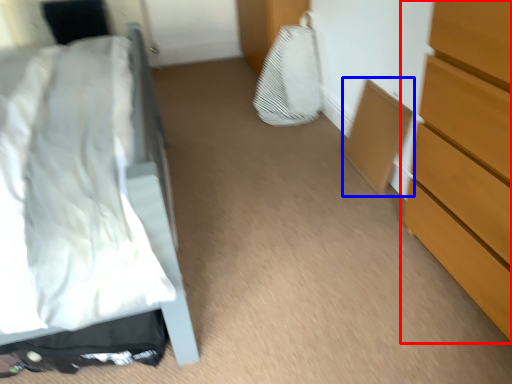
Question: Which object appears closest to the camera in this image, chest of drawers (highlighted by a red box) or cabinetry (highlighted by a blue box)?

Choices:
 (A) chest of drawers
 (B) cabinetry

Answer: (A)